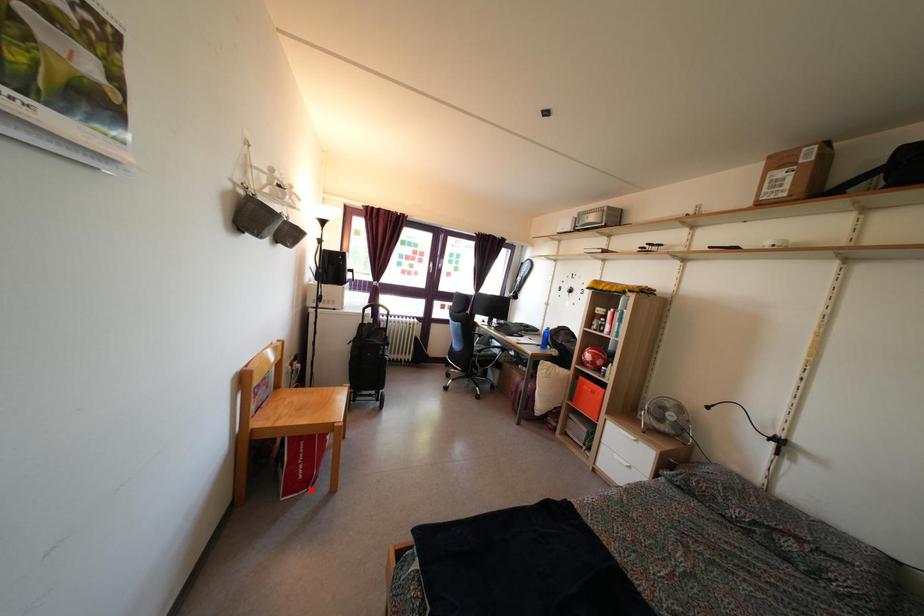
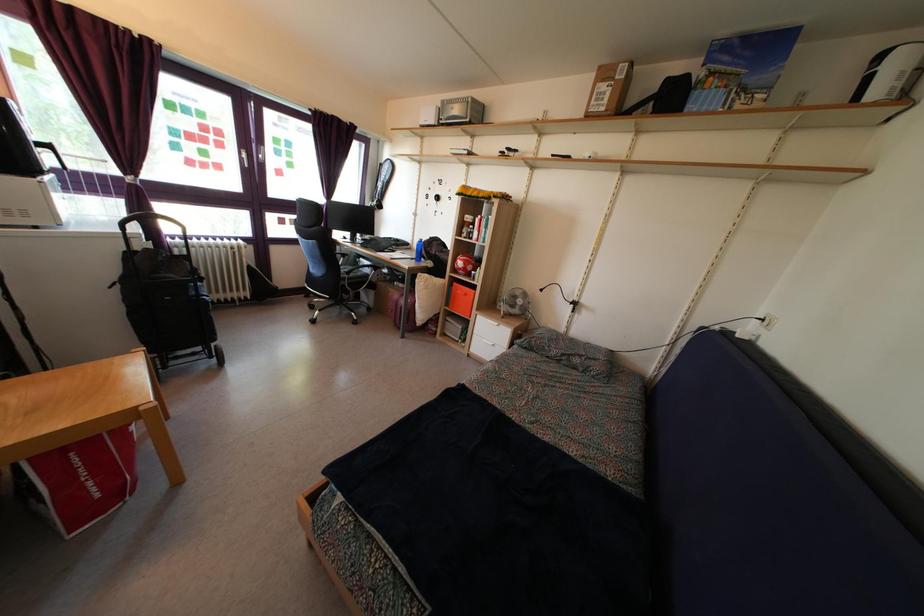
Question: I am providing you with two images of the same scene from different viewpoints. In image1, a red point is highlighted. Considering the same 3D point in image2, which of the following is correct?

Choices:
 (A) It is closer
 (B) It is farther

Answer: (A)